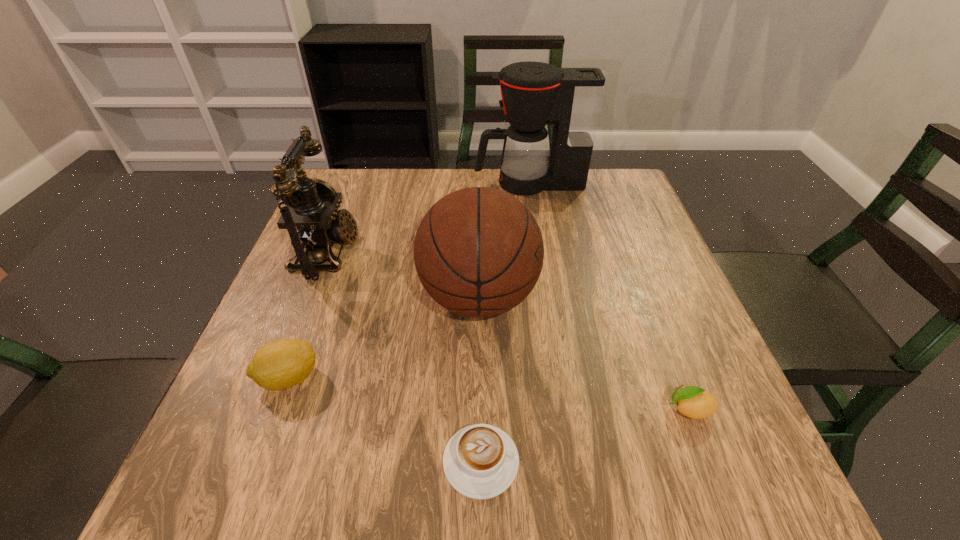
Identify the location of telephone that is at the left edge. (310, 216).

This screenshot has width=960, height=540. I want to click on lemon that is at the left edge, so click(x=282, y=364).

At what (x,y) coordinates should I click in order to perform the action: click on coffee maker that is at the right edge. Please return your answer as a coordinate pair (x, y). This screenshot has height=540, width=960. Looking at the image, I should click on pyautogui.click(x=533, y=93).

Locate an element on the screen. Image resolution: width=960 pixels, height=540 pixels. lemon that is at the right edge is located at coordinates (694, 402).

Where is `object situated at the far right corner`? The height and width of the screenshot is (540, 960). object situated at the far right corner is located at coordinates (533, 93).

This screenshot has height=540, width=960. What are the coordinates of `vacant space at the far edge of the desktop` in the screenshot? It's located at (429, 205).

In the image, there is a desktop. At what (x,y) coordinates should I click in order to perform the action: click on vacant space at the left edge. Please return your answer as a coordinate pair (x, y). This screenshot has width=960, height=540. Looking at the image, I should click on coord(266,342).

In the image, there is a desktop. Where is `free space at the right edge`? This screenshot has width=960, height=540. free space at the right edge is located at coordinates (652, 251).

Image resolution: width=960 pixels, height=540 pixels. In the image, there is a desktop. In order to click on blank space at the far left corner in this screenshot , I will do `click(380, 187)`.

You are a GUI agent. You are given a task and a screenshot of the screen. Output one action in this format:
    pyautogui.click(x=<x>, y=<y>)
    Task: Click on the vacant space at the near left corner of the desktop
    The height and width of the screenshot is (540, 960).
    Given the screenshot: What is the action you would take?
    196,478